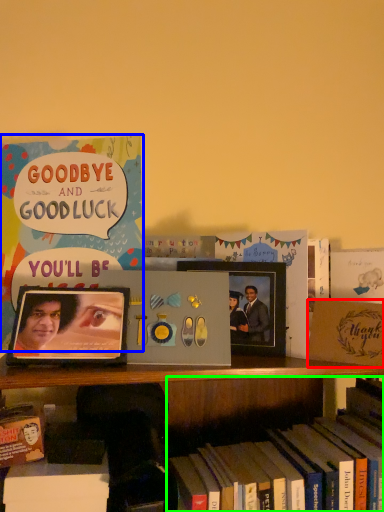
Question: Which is farther away from paperback book (highlighted by a red box)? book (highlighted by a blue box) or book (highlighted by a green box)?

Choices:
 (A) book
 (B) book

Answer: (A)